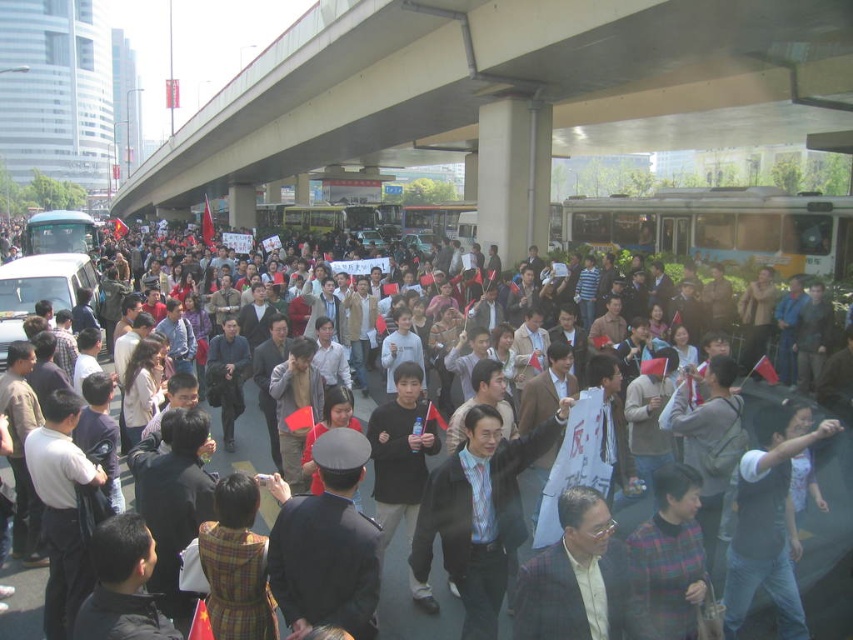
Question: Does concrete bridge at upper center appear under plaid suit at center?

Choices:
 (A) yes
 (B) no

Answer: (B)

Question: Which point is farther to the camera?

Choices:
 (A) dark blue uniform at center
 (B) concrete bridge at upper center
 (C) dark blue suit at center

Answer: (B)

Question: Does concrete bridge at upper center appear on the right side of dark blue suit at center?

Choices:
 (A) no
 (B) yes

Answer: (A)

Question: Among these points, which one is farthest from the camera?

Choices:
 (A) (463, 440)
 (B) (593, 614)

Answer: (A)

Question: Observing the image, what is the correct spatial positioning of dark blue uniform at center in reference to plaid suit at center?

Choices:
 (A) above
 (B) below

Answer: (B)

Question: Estimate the real-world distances between objects in this image. Which object is farther from the concrete bridge at upper center?

Choices:
 (A) plaid suit at center
 (B) dark blue suit at center

Answer: (B)